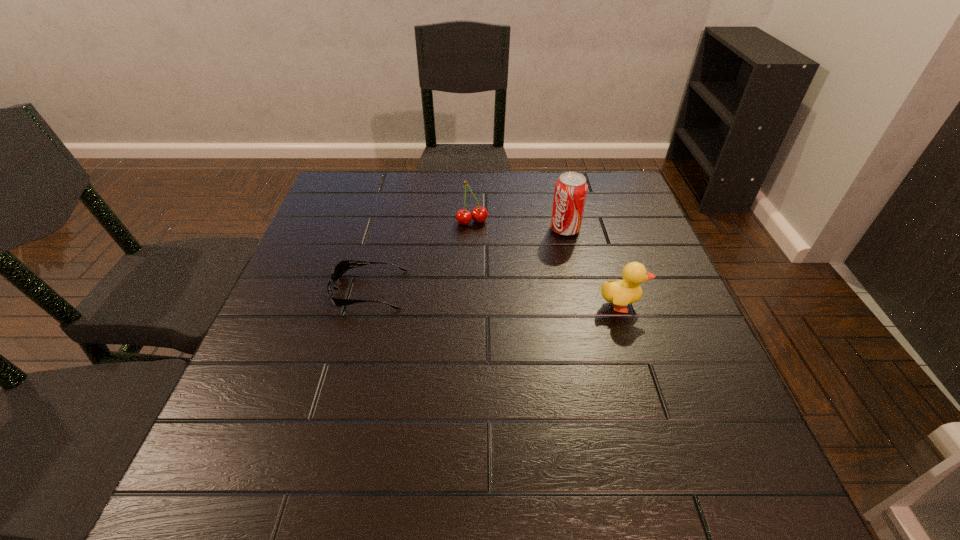
Where is `free spot on the desktop that is between the sunglasses and the duckling and is positioned with the stems of the second object from left to right pointing upwards`? Image resolution: width=960 pixels, height=540 pixels. free spot on the desktop that is between the sunglasses and the duckling and is positioned with the stems of the second object from left to right pointing upwards is located at coordinates (506, 298).

What are the coordinates of `vacant spot on the desktop that is between the leftmost object and the duckling and is positioned on the logo side of the soda can` in the screenshot? It's located at (469, 296).